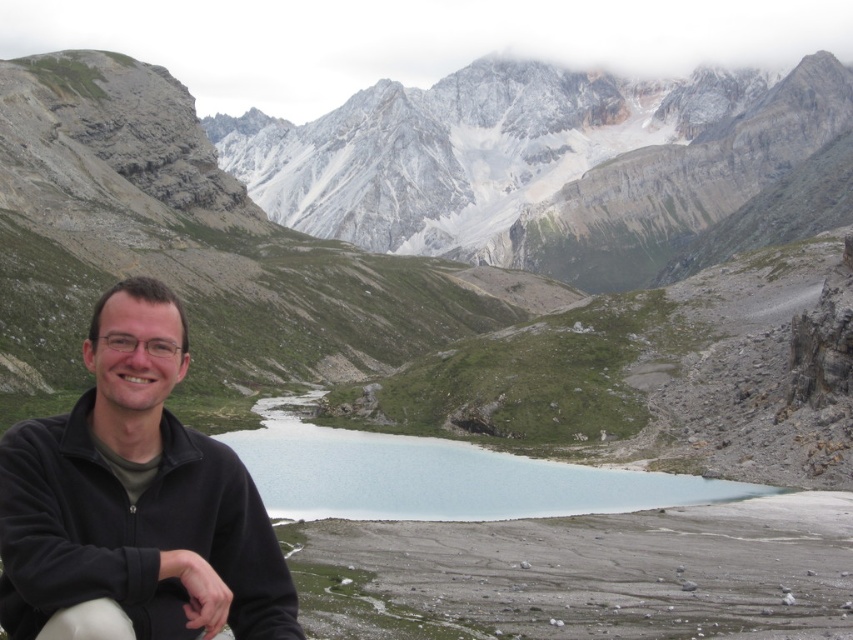
You are a photographer planning to capture a reflection of the mountains in the clear blue water at center. However, you notice the black fleece jacket at lower left might obstruct the view. Can you position yourself so that the jacket is out of frame while still capturing the reflection?

The black fleece jacket at lower left is positioned on the left side of clear blue water at center. To avoid the jacket, move to the right side of the clear blue water at center where the jacket won not be in the frame.

You are planning a photography session and want to ensure your camera can capture both the gray rocky mountain at upper center and the black fleece jacket at lower left in the same frame. Given that your camera has a standard zoom lens, which object should you focus on first to ensure both are in focus?

You should focus on the gray rocky mountain at upper center first because it is taller than the black fleece jacket at lower left, so ensuring it is in focus will help both objects remain sharp in the frame.